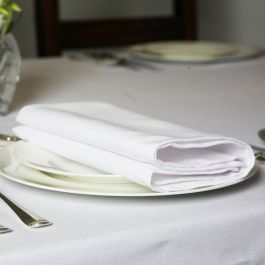
Locate an element on the screen. round white dinner plates is located at coordinates (71, 189), (167, 59).